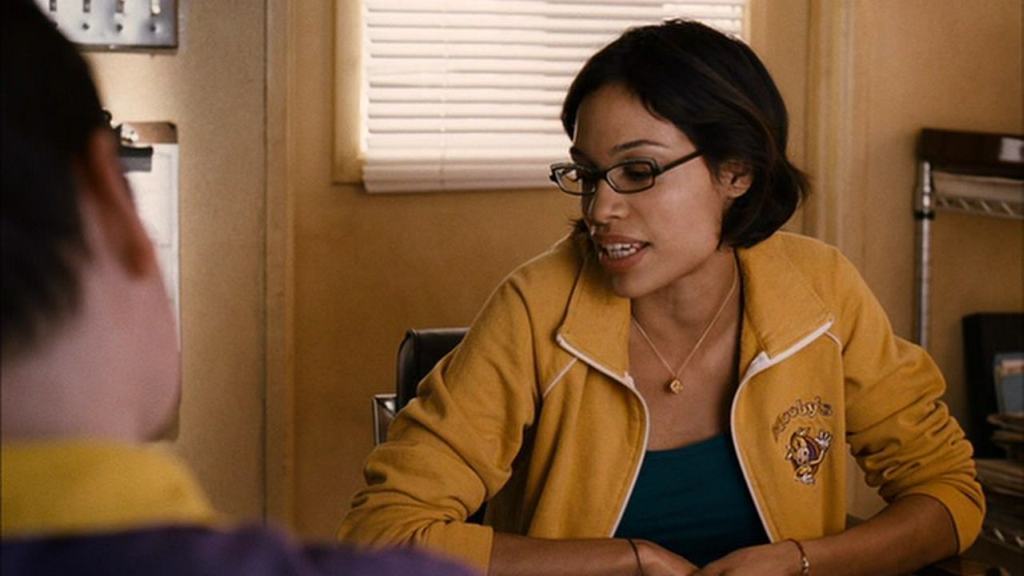
The image size is (1024, 576). Find the location of `switches`. switches is located at coordinates (116, 3), (151, 2), (85, 6).